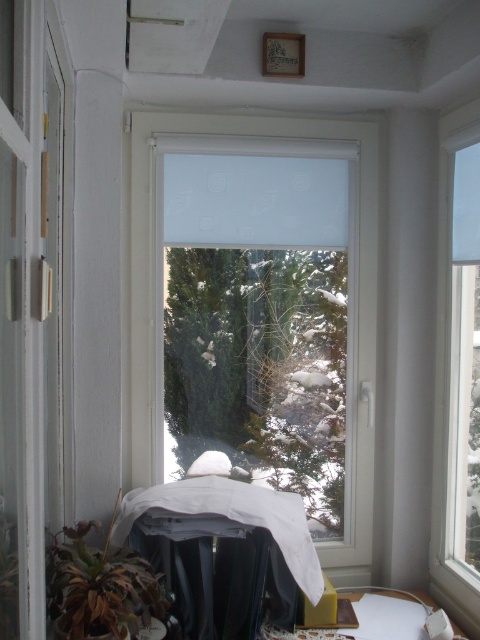
Between transparent plastic window at center and transparent glass window at right, which one has more height?

Standing taller between the two is transparent glass window at right.

Does point (227, 124) come behind point (451, 460)?

Yes, point (227, 124) is behind point (451, 460).

At what (x,y) coordinates should I click in order to perform the action: click on transparent plastic window at center. Please return your answer as a coordinate pair (x, y). The image size is (480, 640). Looking at the image, I should click on (x=259, y=310).

Is transparent glass window at right shorter than green matte plant at lower left?

Incorrect, transparent glass window at right's height does not fall short of green matte plant at lower left's.

Between transparent glass window at right and green matte plant at lower left, which one is positioned lower?

green matte plant at lower left

Which is in front, point (444, 557) or point (133, 605)?

Positioned in front is point (133, 605).

Identify the location of transparent glass window at right. (456, 371).

Is transparent plastic window at center bigger than green matte plant at lower left?

Yes, transparent plastic window at center is bigger than green matte plant at lower left.

Does transparent plastic window at center appear on the left side of green matte plant at lower left?

No, transparent plastic window at center is not to the left of green matte plant at lower left.

Which is behind, point (216, 449) or point (103, 616)?

The point (216, 449) is more distant.

You are a GUI agent. You are given a task and a screenshot of the screen. Output one action in this format:
    pyautogui.click(x=<x>, y=<y>)
    Task: Click on the transparent plastic window at center
    
    Given the screenshot: What is the action you would take?
    pyautogui.click(x=259, y=310)